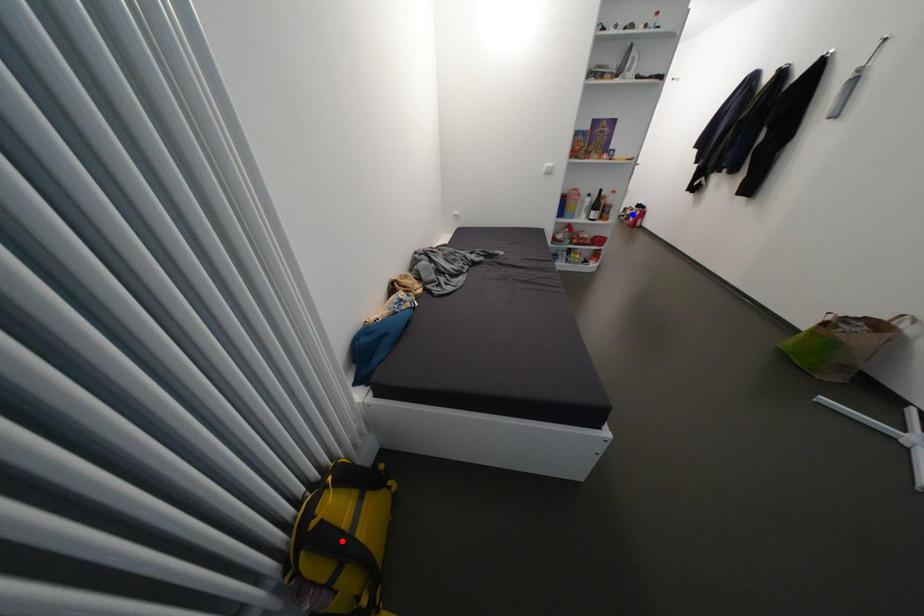
Question: In the image, two points are highlighted. Which point is nearer to the camera? Reply with the corresponding letter.

Choices:
 (A) blue point
 (B) red point

Answer: (B)